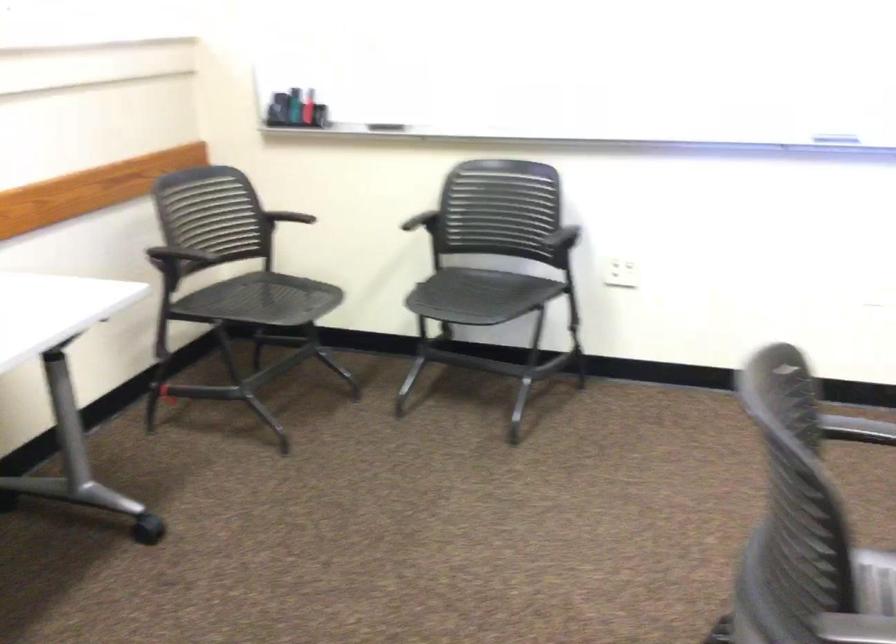
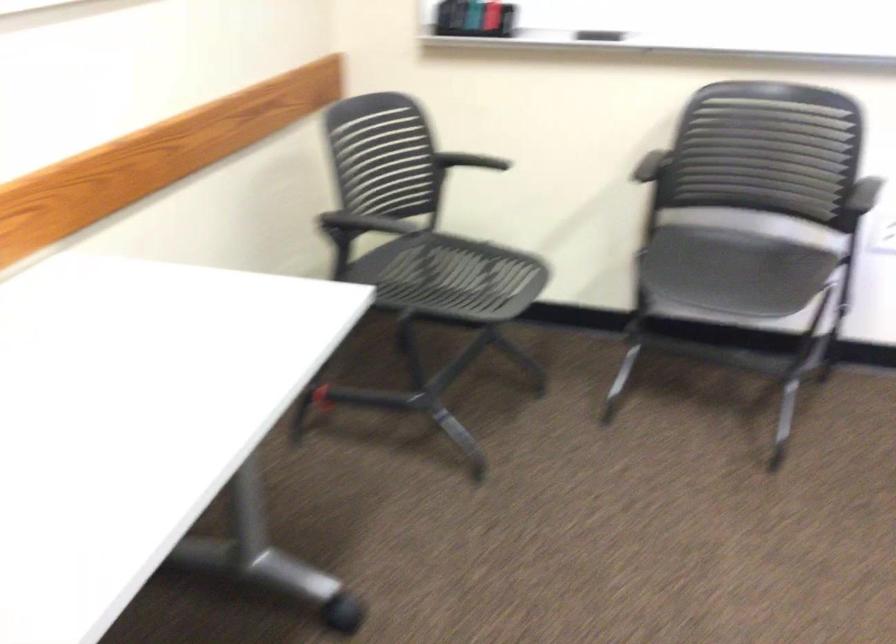
Where in the second image is the point corresponding to point 186,251 from the first image?

(364, 223)